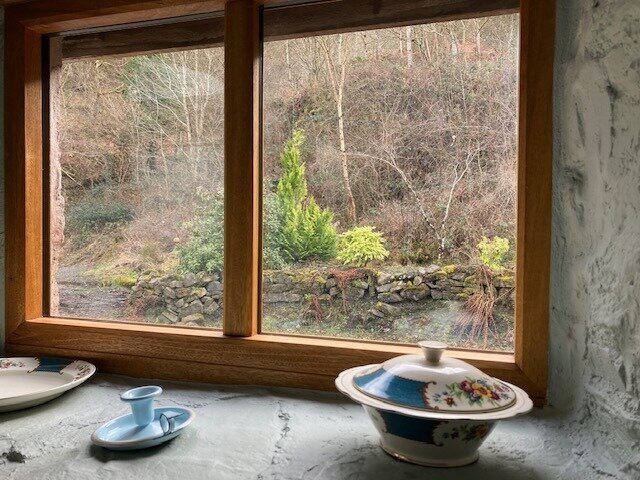
The image size is (640, 480). In order to click on brown wood trimming window in this screenshot , I will do `click(252, 352)`.